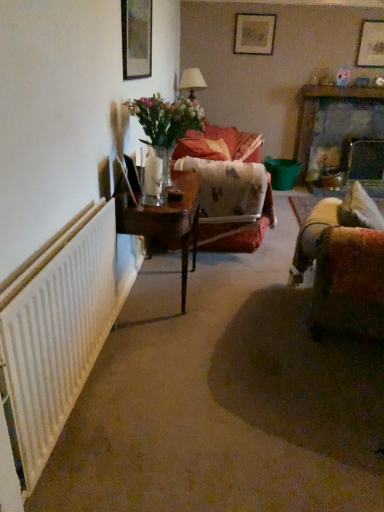
Question: From a real-world perspective, is matte wooden picture frame at upper center, acting as the first picture frame starting from the back, positioned above or below velvet floral couch at center?

Choices:
 (A) below
 (B) above

Answer: (B)

Question: Considering the positions of matte wooden picture frame at upper center, positioned as the 3th picture frame in front-to-back order, and velvet floral couch at center in the image, is matte wooden picture frame at upper center, positioned as the 3th picture frame in front-to-back order, taller or shorter than velvet floral couch at center?

Choices:
 (A) short
 (B) tall

Answer: (A)

Question: Estimate the real-world distances between objects in this image. Which object is closer to the velvet floral couch at center?

Choices:
 (A) wooden picture frame at upper left, acting as the 1th picture frame starting from the left
 (B) wooden table at center
 (C) velvet brown couch at right
 (D) clear glass vase at center
 (E) white textured radiator at left

Answer: (B)

Question: Considering the real-world distances, which object is farthest from the velvet floral couch at center?

Choices:
 (A) wooden picture frame at upper left, positioned as the third picture frame in back-to-front order
 (B) wooden picture frame at upper right, positioned as the 2th picture frame in top-to-bottom order
 (C) matte wooden picture frame at upper center, acting as the first picture frame starting from the back
 (D) velvet brown couch at right
 (E) white textured radiator at left

Answer: (B)